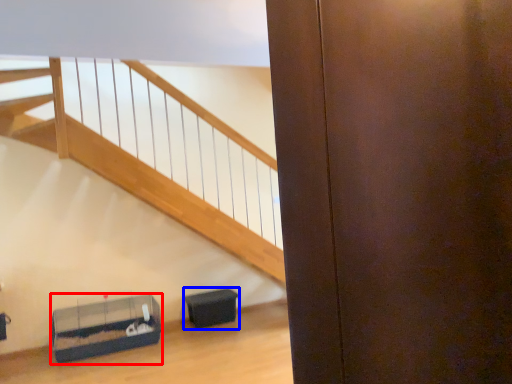
Question: Which of the following is the closest to the observer, furniture (highlighted by a red box) or furniture (highlighted by a blue box)?

Choices:
 (A) furniture
 (B) furniture

Answer: (A)